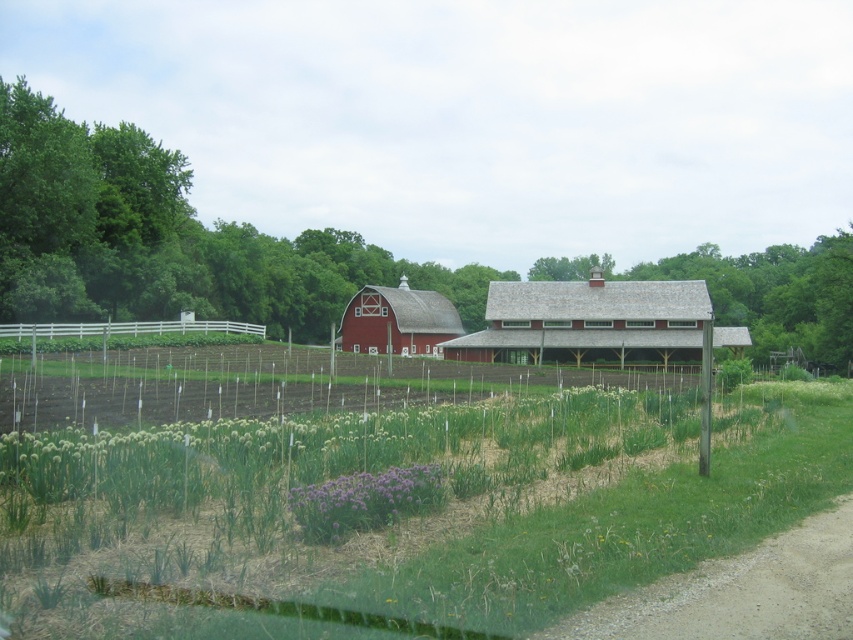
You are a farmer checking the layout of your farm. You have to decide where to place a new scarecrow. The scarecrow needs a spot that is large enough to be seen from both the garden and the field. Based on the image, which location would you choose between the green grassy field at lower center and the purple matte flower at center?

The green grassy field at lower center is bigger than the purple matte flower at center, so placing the scarecrow there would provide a larger area for visibility from both the garden and the field.

You are standing at the point marked as point (589, 323) in the image. What structure are you currently on?

The point (589, 323) is on the red wooden barn at center, so you are currently on the red wooden barn at center.

You are standing at the garden plot in the foreground and want to walk to the white picket fence. Which point, point (640, 572) or point (579, 308), is closer to your current position?

Point (640, 572) is closer to the viewer than point (579, 308), so it is closer to your current position at the garden plot.